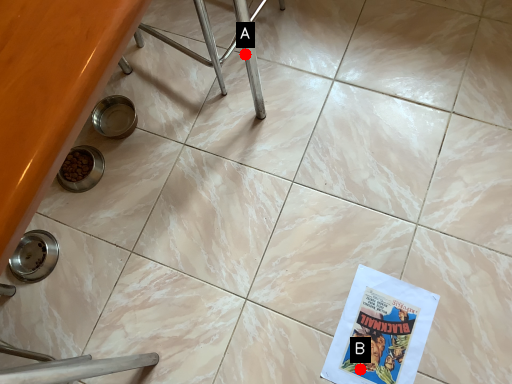
Question: Two points are circled on the image, labeled by A and B beside each circle. Which of the following is the closest to the observer?

Choices:
 (A) A is closer
 (B) B is closer

Answer: (B)